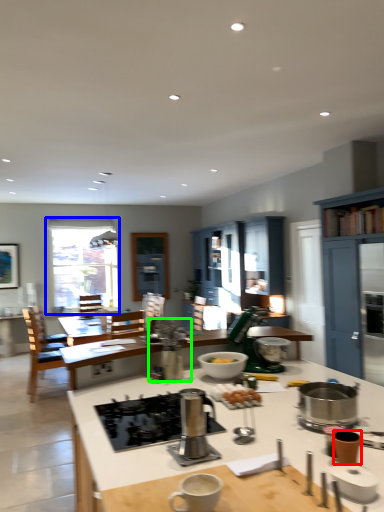
Question: Considering the real-world distances, which object is farthest from appliance (highlighted by a red box)? window (highlighted by a blue box) or appliance (highlighted by a green box)?

Choices:
 (A) window
 (B) appliance

Answer: (A)